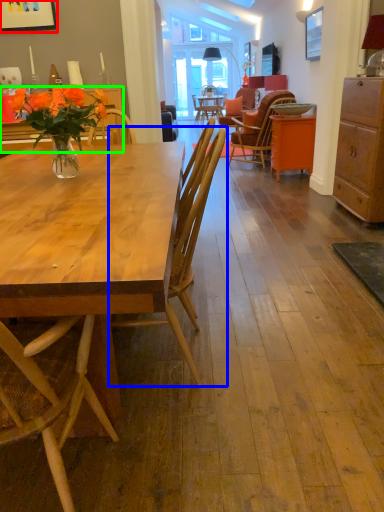
Question: Considering the real-world distances, which object is closest to picture frame (highlighted by a red box)? chair (highlighted by a blue box) or desk (highlighted by a green box).

Choices:
 (A) chair
 (B) desk

Answer: (B)